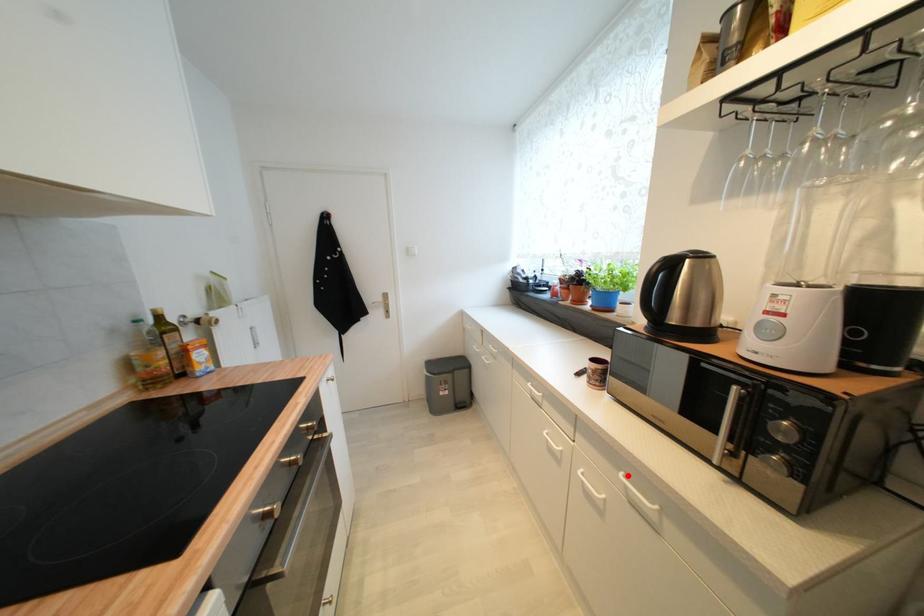
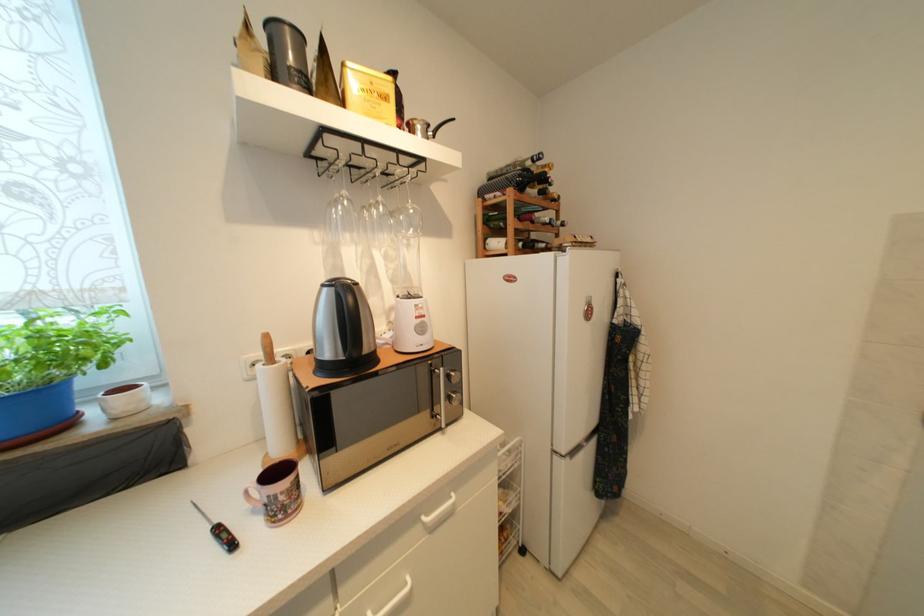
Question: I am providing you with two images of the same scene from different viewpoints. Given a red point in image1, look at the same physical point in image2. Is it:

Choices:
 (A) Closer to the viewpoint
 (B) Farther from the viewpoint

Answer: (B)